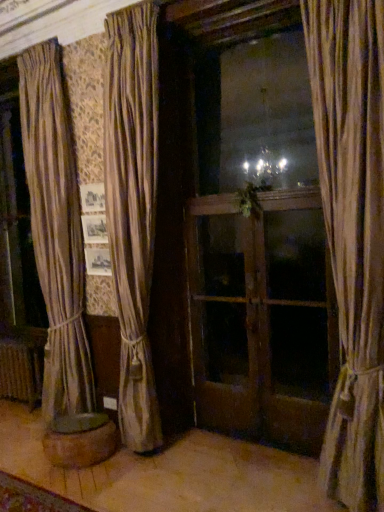
Question: Can you confirm if silky beige curtain at center, arranged as the 2th curtain when viewed from the front, is thinner than beige fabric curtain at right, the first curtain when ordered from right to left?

Choices:
 (A) no
 (B) yes

Answer: (A)

Question: Is silky beige curtain at center, arranged as the 2th curtain when viewed from the front, facing towards beige fabric curtain at right, marked as the 1th curtain in a front-to-back arrangement?

Choices:
 (A) no
 (B) yes

Answer: (A)

Question: Is silky beige curtain at center, which ranks as the 1th curtain in back-to-front order, at the right side of beige fabric curtain at right, which is the 2th curtain from back to front?

Choices:
 (A) no
 (B) yes

Answer: (A)

Question: Does silky beige curtain at center, arranged as the 2th curtain when viewed from the front, come in front of beige fabric curtain at right, marked as the 1th curtain in a front-to-back arrangement?

Choices:
 (A) yes
 (B) no

Answer: (B)

Question: From the image's perspective, does silky beige curtain at center, which ranks as the 1th curtain in back-to-front order, appear higher than beige fabric curtain at right, marked as the 1th curtain in a front-to-back arrangement?

Choices:
 (A) no
 (B) yes

Answer: (B)

Question: Based on their sizes in the image, would you say beige fabric curtain at right, marked as the 1th curtain in a front-to-back arrangement, is bigger or smaller than green leafy plant at center?

Choices:
 (A) big
 (B) small

Answer: (A)

Question: From the image's perspective, is beige fabric curtain at right, the first curtain when ordered from right to left, located above or below green leafy plant at center?

Choices:
 (A) above
 (B) below

Answer: (B)

Question: From their relative heights in the image, would you say beige fabric curtain at right, which is the 2th curtain from back to front, is taller or shorter than green leafy plant at center?

Choices:
 (A) short
 (B) tall

Answer: (B)

Question: Is beige fabric curtain at right, the first curtain when ordered from right to left, situated inside green leafy plant at center or outside?

Choices:
 (A) inside
 (B) outside

Answer: (B)

Question: Considering the positions of rustic metal radiator at lower left and silky beige curtain at center, which appears as the 2th curtain when viewed from the right, in the image, is rustic metal radiator at lower left wider or thinner than silky beige curtain at center, which appears as the 2th curtain when viewed from the right,?

Choices:
 (A) wide
 (B) thin

Answer: (B)

Question: Is rustic metal radiator at lower left inside or outside of silky beige curtain at center, which is the first curtain in left-to-right order?

Choices:
 (A) inside
 (B) outside

Answer: (B)

Question: Does point (29, 403) appear closer or farther from the camera than point (157, 437)?

Choices:
 (A) closer
 (B) farther

Answer: (B)

Question: Visually, is rustic metal radiator at lower left positioned to the left or to the right of silky beige curtain at center, which ranks as the 1th curtain in back-to-front order?

Choices:
 (A) left
 (B) right

Answer: (A)

Question: From their relative heights in the image, would you say wooden screen door at center, which is the 2th screen door in left-to-right order, is taller or shorter than green leafy plant at center?

Choices:
 (A) tall
 (B) short

Answer: (A)

Question: From a real-world perspective, is wooden screen door at center, positioned as the first screen door in right-to-left order, positioned above or below green leafy plant at center?

Choices:
 (A) below
 (B) above

Answer: (A)